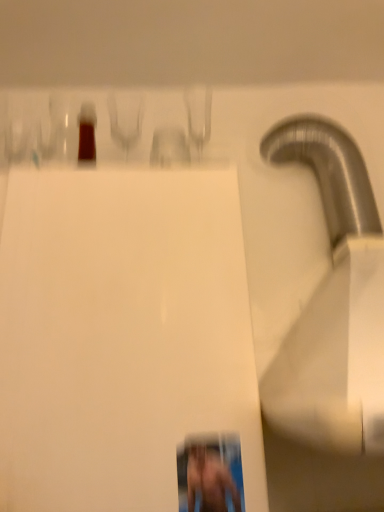
Question: Does smooth skin person at lower right touch white glossy paper at center?

Choices:
 (A) yes
 (B) no

Answer: (B)

Question: Is smooth skin person at lower right turned away from white glossy paper at center?

Choices:
 (A) no
 (B) yes

Answer: (B)

Question: Is smooth skin person at lower right outside of white glossy paper at center?

Choices:
 (A) yes
 (B) no

Answer: (B)

Question: Does smooth skin person at lower right have a larger size compared to white glossy paper at center?

Choices:
 (A) no
 (B) yes

Answer: (A)

Question: From a real-world perspective, is smooth skin person at lower right positioned under white glossy paper at center based on gravity?

Choices:
 (A) yes
 (B) no

Answer: (A)

Question: Does smooth skin person at lower right have a lesser width compared to white glossy paper at center?

Choices:
 (A) yes
 (B) no

Answer: (A)

Question: Is smooth skin person at lower right located within white glossy paper at center?

Choices:
 (A) no
 (B) yes

Answer: (B)

Question: Does white glossy paper at center have a larger size compared to smooth skin person at lower right?

Choices:
 (A) yes
 (B) no

Answer: (A)

Question: Is white glossy paper at center wider than smooth skin person at lower right?

Choices:
 (A) no
 (B) yes

Answer: (B)

Question: Is white glossy paper at center smaller than smooth skin person at lower right?

Choices:
 (A) yes
 (B) no

Answer: (B)

Question: Can we say white glossy paper at center lies outside smooth skin person at lower right?

Choices:
 (A) no
 (B) yes

Answer: (B)

Question: From a real-world perspective, is white glossy paper at center below smooth skin person at lower right?

Choices:
 (A) yes
 (B) no

Answer: (B)

Question: Relative to smooth skin person at lower right, is white glossy paper at center in front or behind?

Choices:
 (A) front
 (B) behind

Answer: (A)